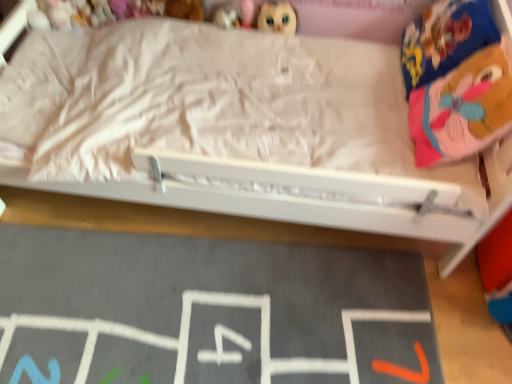
Question: Looking at their shapes, would you say matte plastic doll at upper center, the first toy positioned from the right, is wider or thinner than plush toy at upper left, the 1th toy from the left?

Choices:
 (A) thin
 (B) wide

Answer: (B)

Question: From the image's perspective, is matte plastic doll at upper center, positioned as the 4th toy in left-to-right order, above or below plush toy at upper left, the 1th toy from the left?

Choices:
 (A) above
 (B) below

Answer: (B)

Question: Which is farther from the pink fabric pillow at upper right?

Choices:
 (A) black chalkboard at lower center
 (B) matte plastic toy at upper center, the second toy when ordered from right to left
 (C) soft plush bear at upper center, the second toy in the left-to-right sequence
 (D) white fabric bed at upper center
 (E) plush toy at upper left, which is the 4th toy in right-to-left order

Answer: (E)

Question: Estimate the real-world distances between objects in this image. Which object is closer to the pink fabric pillow at upper right?

Choices:
 (A) matte plastic doll at upper center, positioned as the 4th toy in left-to-right order
 (B) soft plush bear at upper center, the third toy when ordered from right to left
 (C) plush toy at upper left, which is the 4th toy in right-to-left order
 (D) black chalkboard at lower center
 (E) white fabric bed at upper center

Answer: (E)